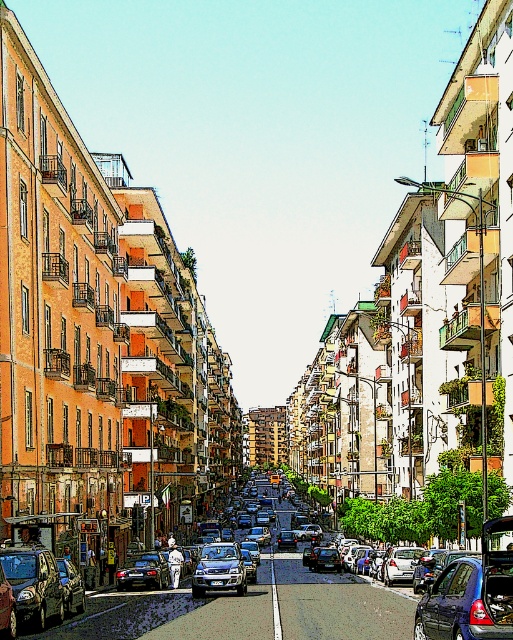
You are standing at the point labeled as point (143, 572) in the image. What object are you currently standing on?

The point (143, 572) is on the shiny black sedan at center, so you are standing on the shiny black sedan at center.

You are a pedestrian standing on the sidewalk and want to cross the street. You see the metallic blue hatchback at center and the metallic silver sedan at center. Which vehicle is closer to the dividing line in the middle of the road?

The metallic blue hatchback at center is to the right of the metallic silver sedan at center, so the metallic silver sedan at center is closer to the dividing line in the middle of the road.